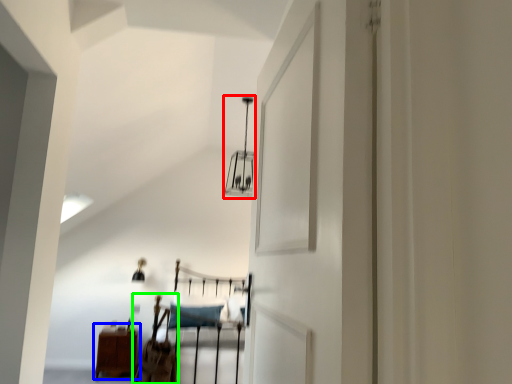
Question: Which object is positioned farthest from light fixture (highlighted by a red box)? Select from furniture (highlighted by a blue box) and chair (highlighted by a green box).

Choices:
 (A) furniture
 (B) chair

Answer: (A)